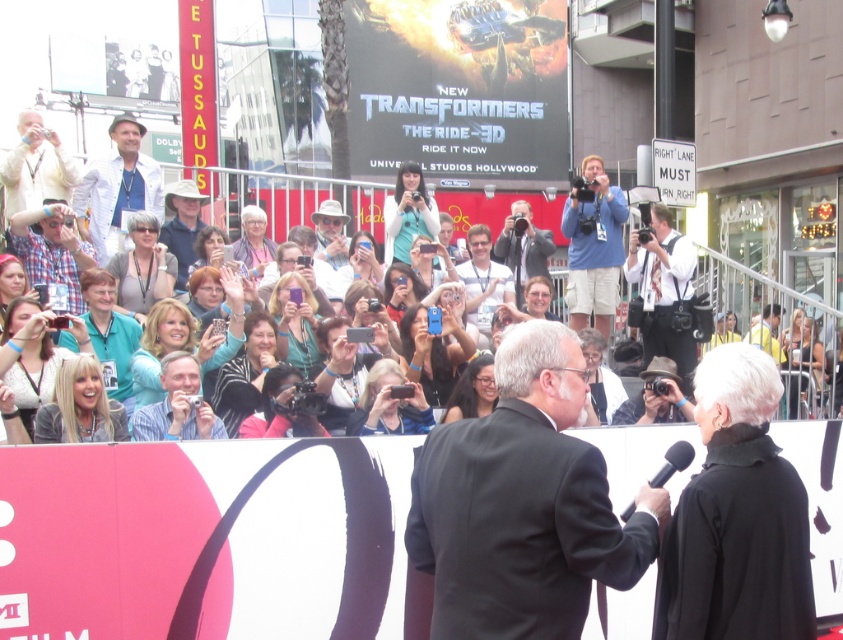
You are at the event and want to take a photo of the yellow shirt at center without the light beige fabric hat at upper left blocking the view. Which direction should you move to ensure the hat is out of frame?

Move to the right so the light beige fabric hat at upper left is no longer blocking the view of the yellow shirt at center.

You are standing at the origin point in the image and want to locate the black suit at center. Which direction should you move to find it?

The black suit at center is located at point 0.794 on the x axis and 0.618 on the y axis. Since the origin is at the bottom left corner, you should move to the right and slightly upwards to reach the black suit at center.